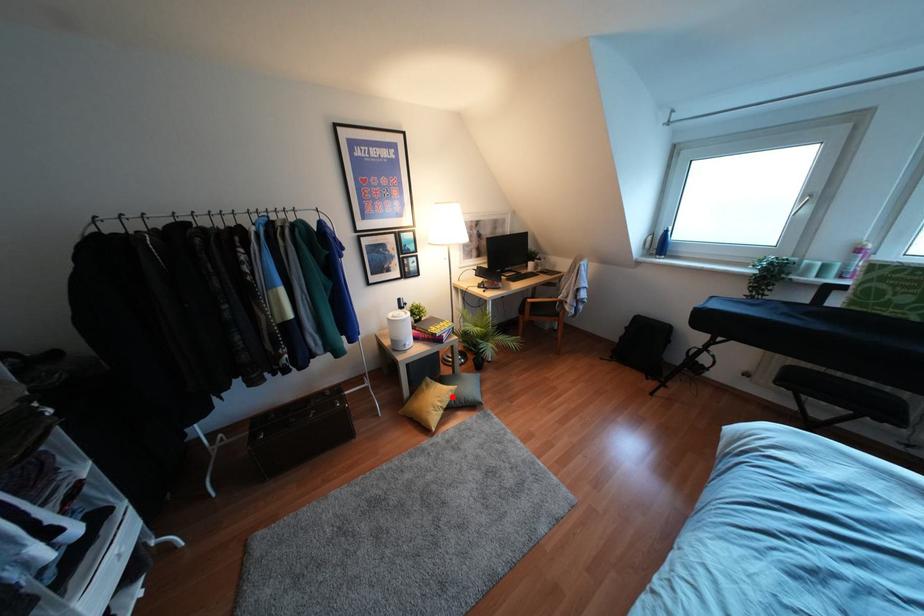
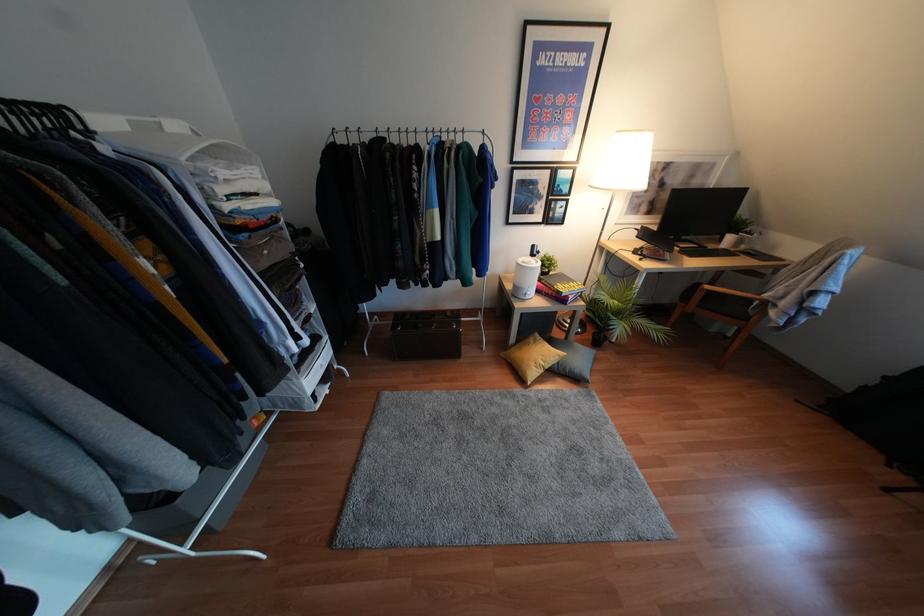
The point at the highlighted location is marked in the first image. Where is the corresponding point in the second image?

(556, 362)